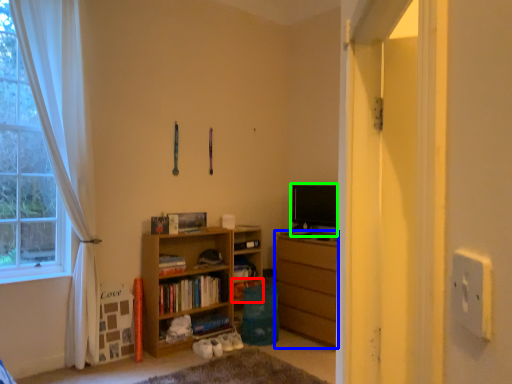
Question: Based on their relative distances, which object is nearer to shelf (highlighted by a red box)? Choose from chest of drawers (highlighted by a blue box) and level (highlighted by a green box).

Choices:
 (A) chest of drawers
 (B) level

Answer: (A)